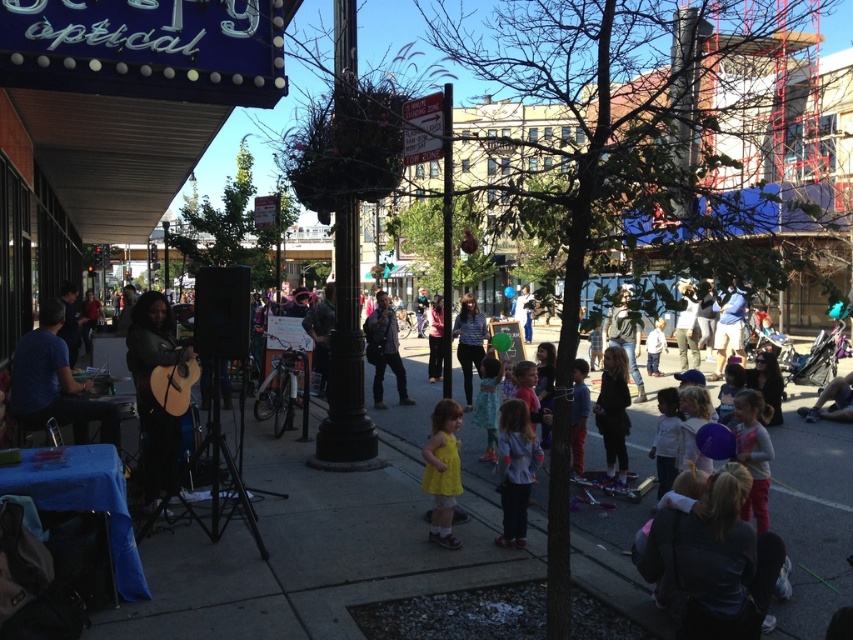
Based on the photo, is light purple shirt at center shorter than dark gray jeans at center?

In fact, light purple shirt at center may be taller than dark gray jeans at center.

Looking at this image, who is positioned more to the left, light purple shirt at center or dark gray jeans at center?

From the viewer's perspective, dark gray jeans at center appears more on the left side.

Measure the distance between light purple shirt at center and camera.

The distance of light purple shirt at center from camera is 17.50 feet.

The image size is (853, 640). I want to click on light purple shirt at center, so click(x=515, y=470).

Does black leather jacket at center come behind striped shirt at center?

No, it is in front of striped shirt at center.

Can you confirm if black leather jacket at center is positioned above striped shirt at center?

No.

What are the coordinates of `black leather jacket at center` in the screenshot? It's located at (613, 412).

You are a GUI agent. You are given a task and a screenshot of the screen. Output one action in this format:
    pyautogui.click(x=<x>, y=<y>)
    Task: Click on the black leather jacket at center
    The height and width of the screenshot is (640, 853).
    Given the screenshot: What is the action you would take?
    pyautogui.click(x=613, y=412)

Between black leather jacket at center and dark gray jeans at center, which one is positioned lower?

black leather jacket at center is lower down.

Does point (605, 413) lie in front of point (383, 353)?

Yes, it is in front of point (383, 353).

Which is in front, point (621, 385) or point (381, 292)?

Positioned in front is point (621, 385).

Locate an element on the screen. The image size is (853, 640). black leather jacket at center is located at coordinates pyautogui.click(x=613, y=412).